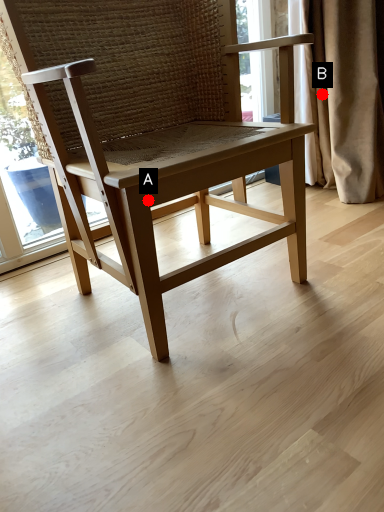
Question: Two points are circled on the image, labeled by A and B beside each circle. Which point is closer to the camera taking this photo?

Choices:
 (A) A is closer
 (B) B is closer

Answer: (A)